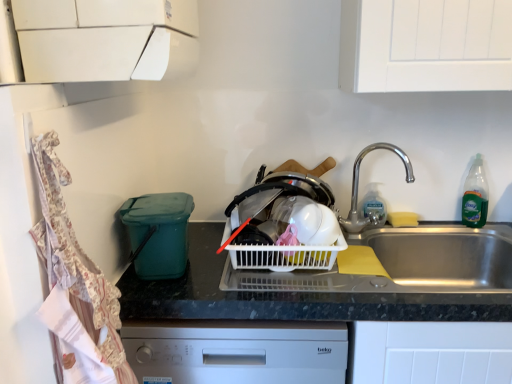
Question: In terms of height, does white plastic basket at center look taller or shorter compared to teal plastic bin at left?

Choices:
 (A) short
 (B) tall

Answer: (A)

Question: Is white plastic basket at center inside or outside of teal plastic bin at left?

Choices:
 (A) outside
 (B) inside

Answer: (A)

Question: Based on their relative distances, which object is nearer to the teal plastic bin at left?

Choices:
 (A) black plastic container at left
 (B) clear plastic soap dispenser at sink right, marked as the 1th bottle in a left-to-right arrangement
 (C) teal plastic bin at left
 (D) white plastic basket at center
 (E) green translucent bottle at right, placed as the 1th bottle when sorted from right to left

Answer: (A)

Question: Considering the real-world distances, which object is closest to the teal plastic bin at left?

Choices:
 (A) clear plastic soap dispenser at sink right, positioned as the second bottle in right-to-left order
 (B) silver metallic faucet at upper right
 (C) black plastic container at left
 (D) white plastic basket at center
 (E) teal plastic bin at left

Answer: (C)